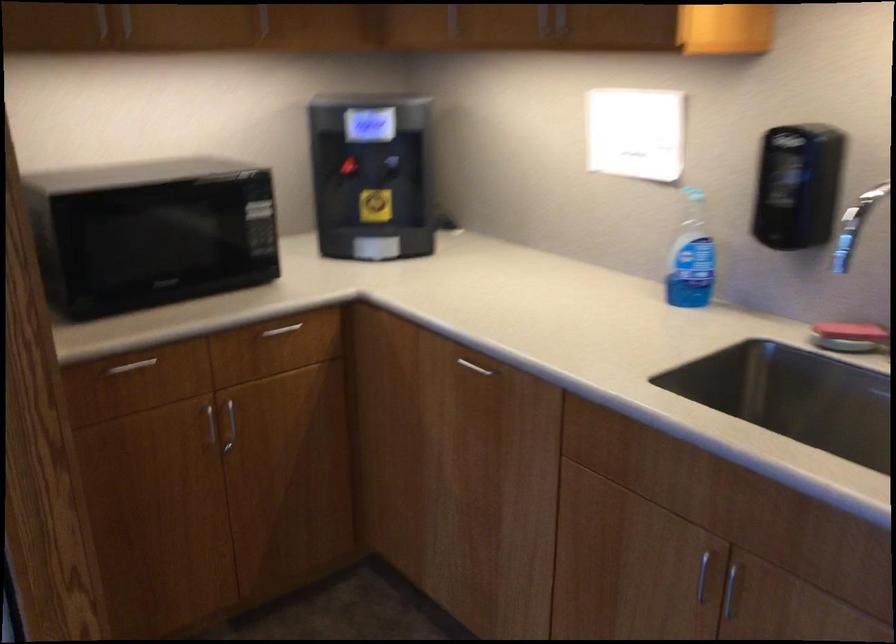
You are a GUI agent. You are given a task and a screenshot of the screen. Output one action in this format:
    pyautogui.click(x=<x>, y=<y>)
    Task: Click on the wall-mounted dispenser
    The width and height of the screenshot is (896, 644).
    Given the screenshot: What is the action you would take?
    pyautogui.click(x=372, y=176)